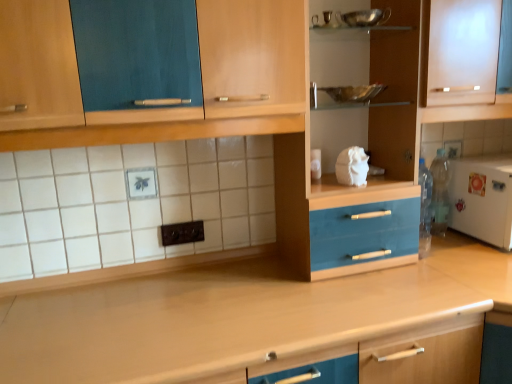
Question: From the image's perspective, is metallic silver bowl at upper center under frosted glass cabinet at upper right?

Choices:
 (A) no
 (B) yes

Answer: (A)

Question: Does metallic silver bowl at upper center have a greater height compared to frosted glass cabinet at upper right?

Choices:
 (A) no
 (B) yes

Answer: (A)

Question: Is metallic silver bowl at upper center turned away from frosted glass cabinet at upper right?

Choices:
 (A) yes
 (B) no

Answer: (B)

Question: Is metallic silver bowl at upper center outside of frosted glass cabinet at upper right?

Choices:
 (A) no
 (B) yes

Answer: (B)

Question: From the image's perspective, is metallic silver bowl at upper center on top of frosted glass cabinet at upper right?

Choices:
 (A) no
 (B) yes

Answer: (B)

Question: Is metallic silver bowl at upper center far from frosted glass cabinet at upper right?

Choices:
 (A) no
 (B) yes

Answer: (A)

Question: Considering the relative sizes of wooden at center and white matte refrigerator at right in the image provided, is wooden at center shorter than white matte refrigerator at right?

Choices:
 (A) yes
 (B) no

Answer: (B)

Question: Is white matte refrigerator at right a part of wooden at center?

Choices:
 (A) no
 (B) yes

Answer: (A)

Question: From a real-world perspective, is wooden at center physically below white matte refrigerator at right?

Choices:
 (A) yes
 (B) no

Answer: (A)

Question: Is white matte refrigerator at right at the back of wooden at center?

Choices:
 (A) no
 (B) yes

Answer: (A)

Question: From the image's perspective, is wooden at center beneath white matte refrigerator at right?

Choices:
 (A) no
 (B) yes

Answer: (B)

Question: Is wooden at center smaller than white matte refrigerator at right?

Choices:
 (A) yes
 (B) no

Answer: (B)

Question: Is frosted glass cabinet at upper right not close to white matte refrigerator at right?

Choices:
 (A) no
 (B) yes

Answer: (A)